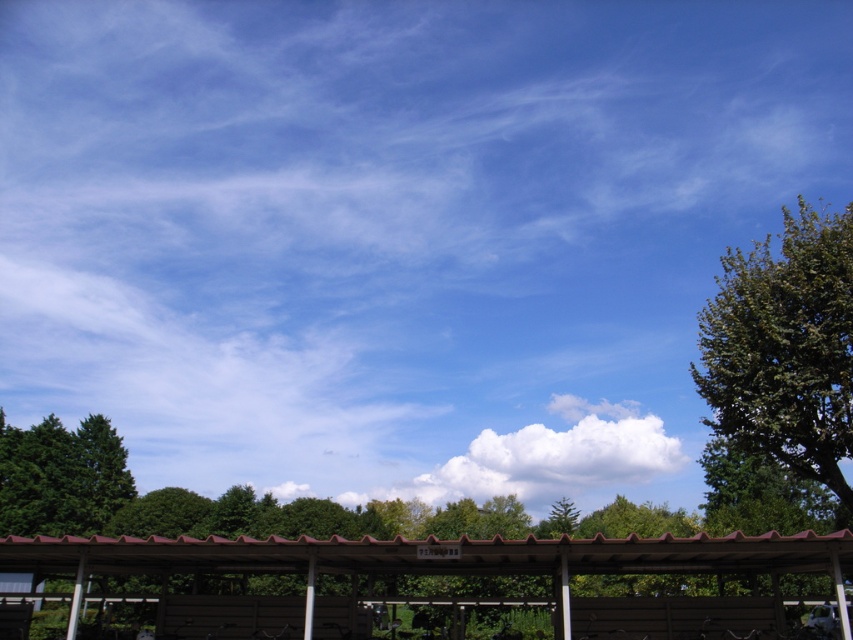
Who is shorter, brown corrugated metal shelter at center or green matte tree at lower left?

green matte tree at lower left

Which is below, brown corrugated metal shelter at center or green matte tree at lower left?

green matte tree at lower left is below.

You are a GUI agent. You are given a task and a screenshot of the screen. Output one action in this format:
    pyautogui.click(x=<x>, y=<y>)
    Task: Click on the brown corrugated metal shelter at center
    This screenshot has height=640, width=853.
    Given the screenshot: What is the action you would take?
    pyautogui.click(x=436, y=557)

Is green leafy tree at right bigger than brown corrugated metal shelter at center?

Yes.

Between green leafy tree at right and brown corrugated metal shelter at center, which one is positioned higher?

green leafy tree at right is above.

Which is in front, point (798, 413) or point (693, 566)?

Point (693, 566) is in front.

Where is `green leafy tree at right`? This screenshot has width=853, height=640. green leafy tree at right is located at coordinates (785, 348).

Can you confirm if white fluffy cloud at center is shorter than green matte tree at lower left?

No, white fluffy cloud at center is not shorter than green matte tree at lower left.

This screenshot has height=640, width=853. Describe the element at coordinates (555, 456) in the screenshot. I see `white fluffy cloud at center` at that location.

What do you see at coordinates (555, 456) in the screenshot?
I see `white fluffy cloud at center` at bounding box center [555, 456].

The image size is (853, 640). In order to click on white fluffy cloud at center in this screenshot , I will do `click(555, 456)`.